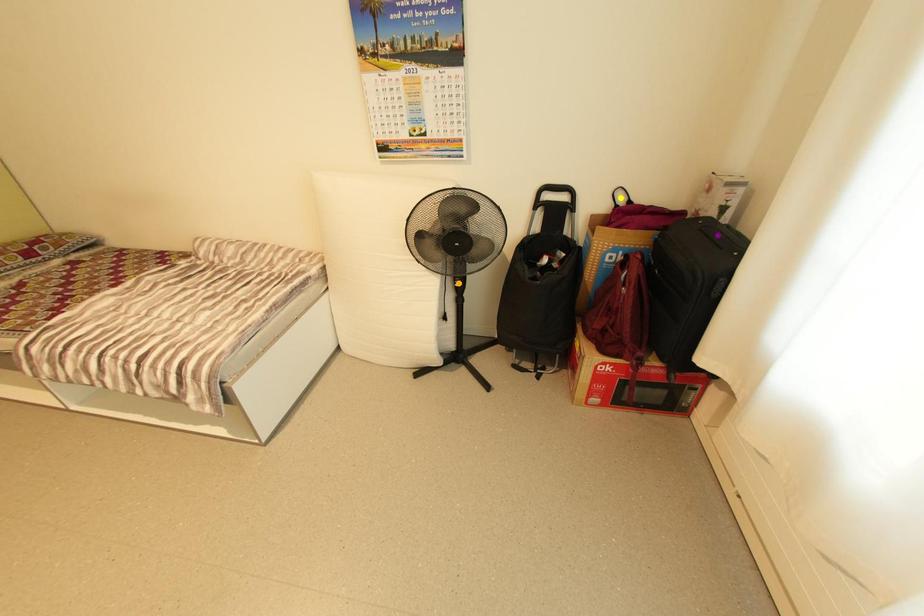
Order these from nearest to farthest:
purple point
yellow point
orange point

purple point → yellow point → orange point